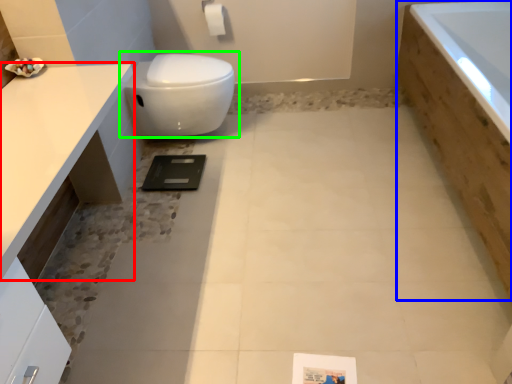
Question: Which object is the closest to the countertop (highlighted by a red box)? Choose among these: bath (highlighted by a blue box) or toilet (highlighted by a green box).

Choices:
 (A) bath
 (B) toilet

Answer: (B)